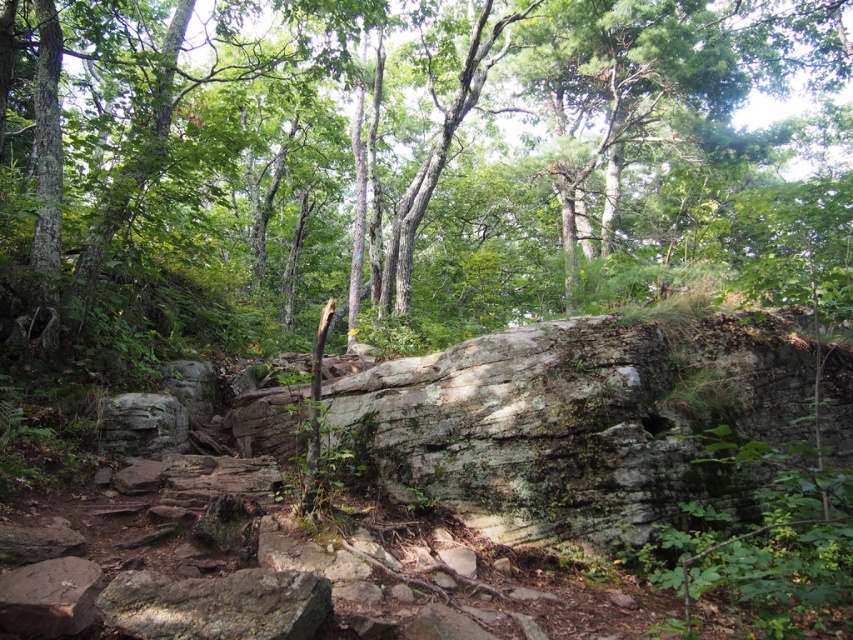
You are navigating through a forest and need to place a small marker exactly at the center of the scene. Given the smooth gray rock at center, can you confirm if the rock is positioned at the exact center coordinates of the image?

The smooth gray rock at center is located at point [405,164], which is not the exact center of the image. Therefore, the rock is not positioned at the exact center coordinates.

You are a hiker who wants to place a small backpack on the smooth gray rock at center and the green mossy rock at lower left. Which rock is positioned to the right side of the other?

The smooth gray rock at center is positioned to the right of the green mossy rock at lower left, so the smooth gray rock at center is on the right side.